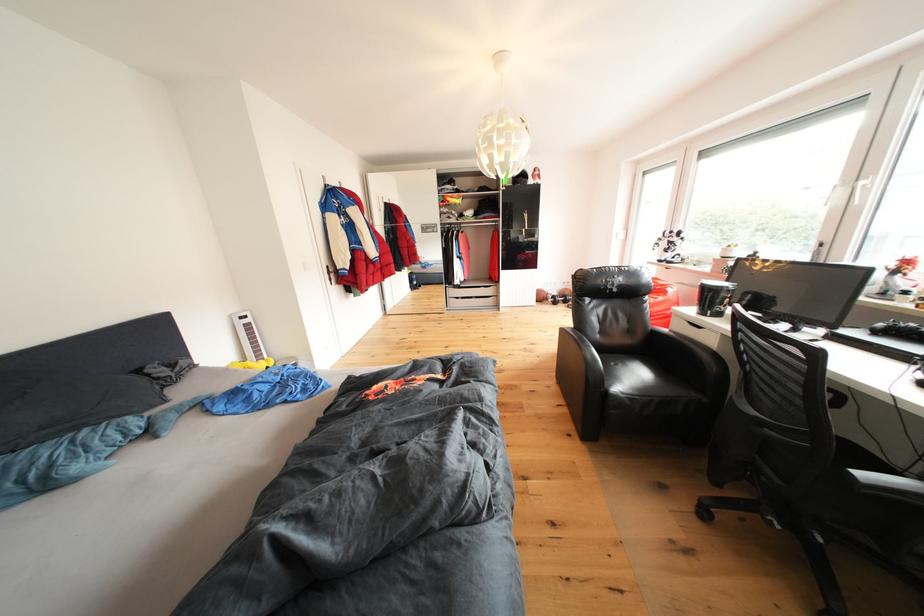
Find the location of a particular element. black patterned mug is located at coordinates [x=713, y=297].